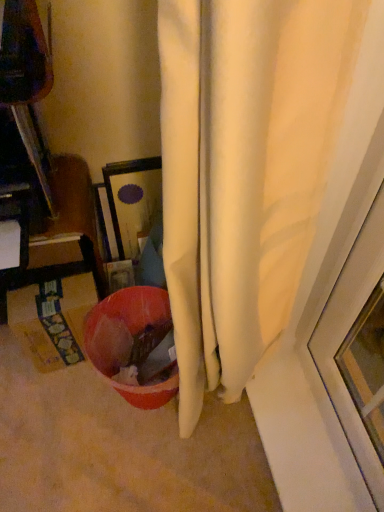
Question: From a real-world perspective, is matte plastic bowl at lower center physically located above or below yellow cardboard box at lower left?

Choices:
 (A) above
 (B) below

Answer: (B)

Question: From the image's perspective, is matte plastic bowl at lower center positioned above or below yellow cardboard box at lower left?

Choices:
 (A) below
 (B) above

Answer: (A)

Question: In the image, is matte plastic bowl at lower center on the left side or the right side of yellow cardboard box at lower left?

Choices:
 (A) left
 (B) right

Answer: (B)

Question: Is yellow cardboard box at lower left in front of or behind matte plastic bowl at lower center in the image?

Choices:
 (A) front
 (B) behind

Answer: (B)

Question: Would you say yellow cardboard box at lower left is to the left or to the right of matte plastic bowl at lower center in the picture?

Choices:
 (A) left
 (B) right

Answer: (A)

Question: From the image's perspective, is yellow cardboard box at lower left located above or below matte plastic bowl at lower center?

Choices:
 (A) above
 (B) below

Answer: (A)

Question: Is point click(72, 348) closer or farther from the camera than point click(119, 309)?

Choices:
 (A) closer
 (B) farther

Answer: (B)